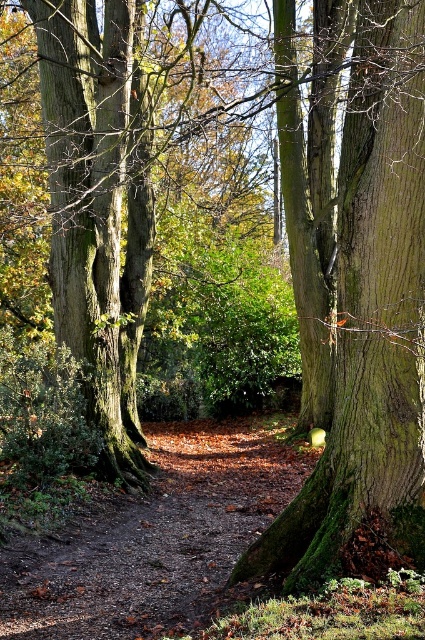
You are a hiker who wants to determine which tree is closer to you. You see the green mossy tree trunk at right and the green mossy tree at left. Which one is smaller in size?

The green mossy tree trunk at right is smaller than the green mossy tree at left, so the green mossy tree trunk at right is closer to you.

You are a hiker walking along the forest path and notice two green mossy trees. You want to find the taller one to take a photo. Which one should you choose between the green mossy tree trunk at right and the green mossy tree at left?

The green mossy tree at left is taller than the green mossy tree trunk at right, so you should choose the green mossy tree at left for your photo.

You are standing at the camera position in the forest scene. A treasure is hidden at point (x=362, y=285). If you walk straight ahead, how far will you have to walk to reach the treasure?

The distance of point (x=362, y=285) from camera is 6.13 meters, so you will have to walk 6.13 meters straight ahead to reach the treasure.